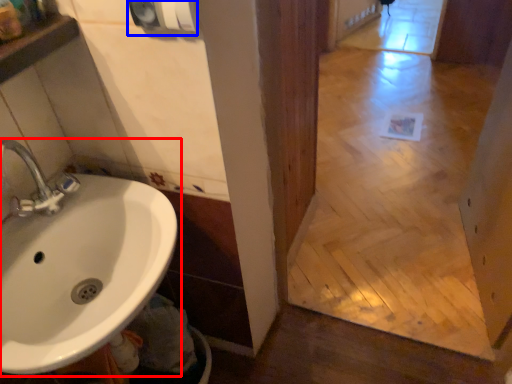
Question: Which point is closer to the camera, sink (highlighted by a red box) or hand dryer (highlighted by a blue box)?

Choices:
 (A) sink
 (B) hand dryer

Answer: (A)